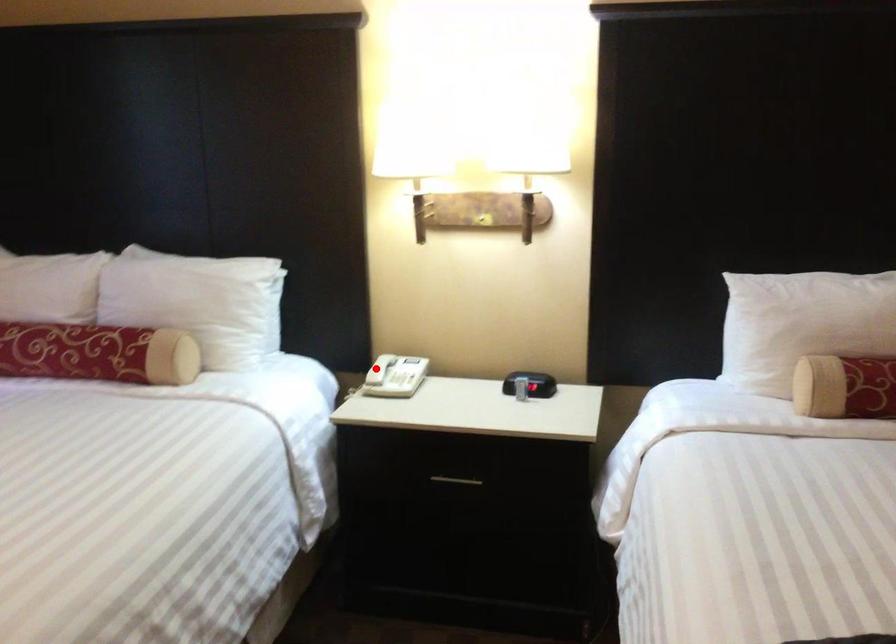
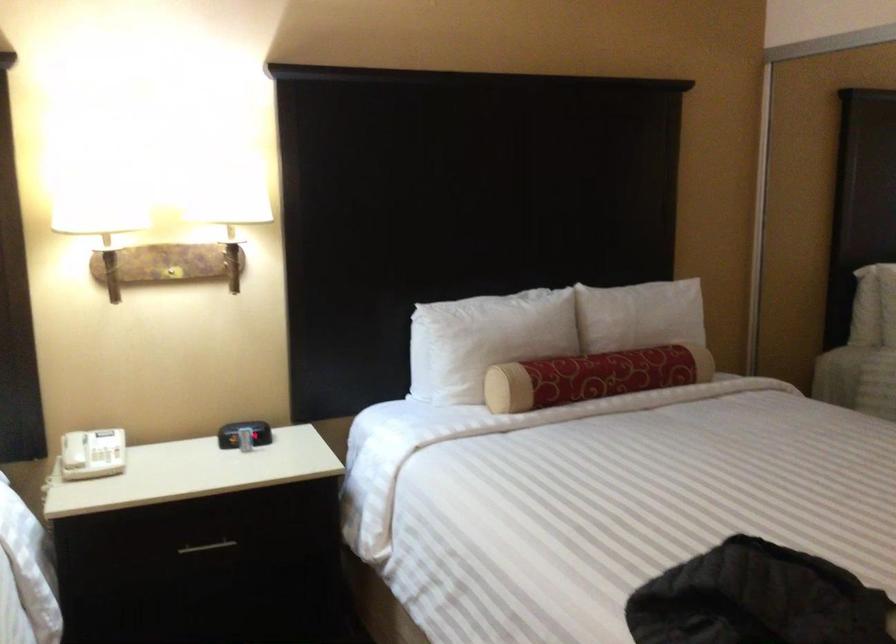
Question: I am providing you with two images of the same scene from different viewpoints. Image1 has a red point marked. In image2, the corresponding 3D location appears at what relative position? Reply with the corresponding letter.

Choices:
 (A) Closer
 (B) Farther

Answer: (A)